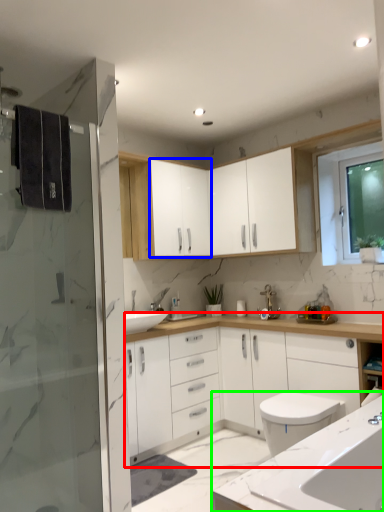
Question: Estimate the real-world distances between objects in this image. Which object is closer to bathroom cabinet (highlighted by a red box), cabinetry (highlighted by a blue box) or countertop (highlighted by a green box)?

Choices:
 (A) cabinetry
 (B) countertop

Answer: (A)